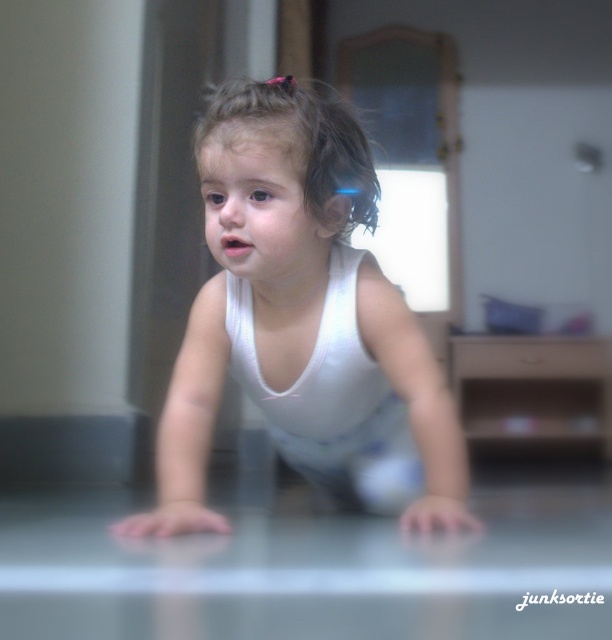
Question: Is the position of white matte toddler at center more distant than that of brown curly hair at center?

Choices:
 (A) no
 (B) yes

Answer: (A)

Question: Can you confirm if white matte toddler at center is thinner than brown curly hair at center?

Choices:
 (A) no
 (B) yes

Answer: (A)

Question: From the image, what is the correct spatial relationship of white matte toddler at center in relation to brown curly hair at center?

Choices:
 (A) below
 (B) above

Answer: (A)